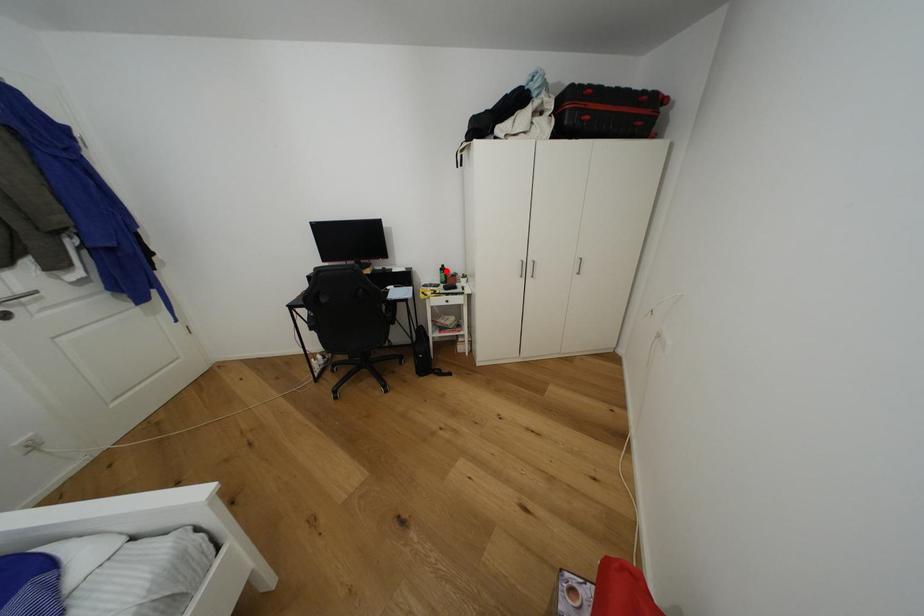
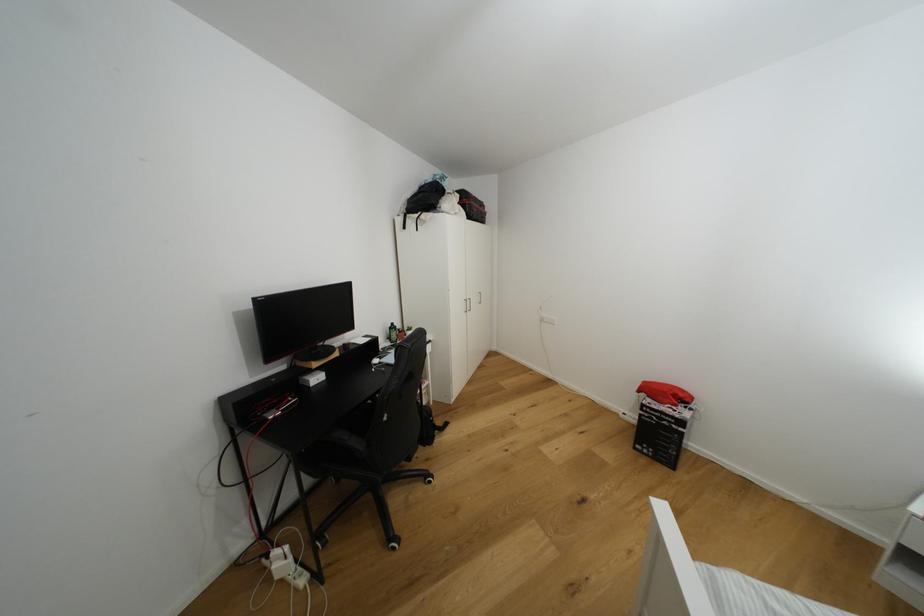
Question: I am providing you with two images of the same scene from different viewpoints. A red point is marked on the first image. At the location where the point appears in image 1, is it still visible in image 2?

Choices:
 (A) Yes
 (B) No

Answer: (A)